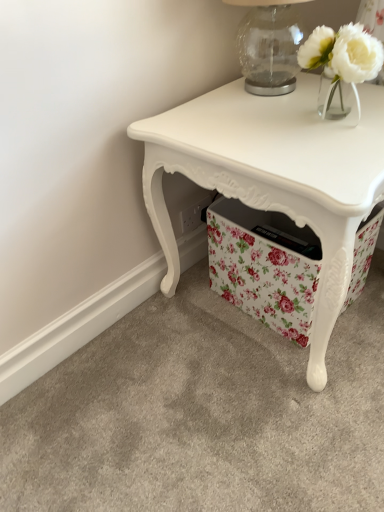
Identify the location of blank area beneath transparent glass table lamp at upper right (from a real-world perspective). (278, 87).